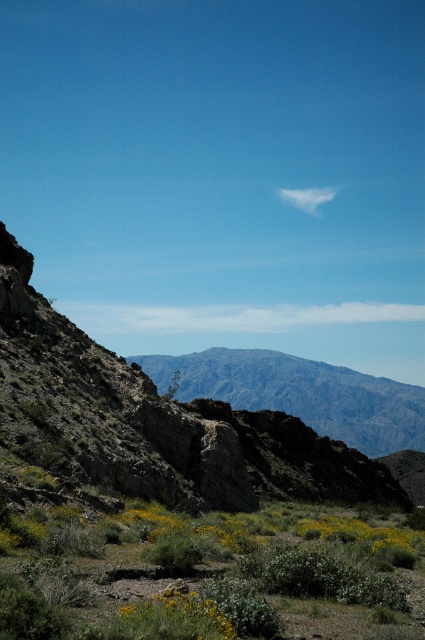
Question: Which object is farther from the camera taking this photo?

Choices:
 (A) gray rocky mountain at center
 (B) rocky at center

Answer: (A)

Question: Is rocky at center smaller than gray rocky mountain at center?

Choices:
 (A) yes
 (B) no

Answer: (A)

Question: Does rocky at center have a larger size compared to gray rocky mountain at center?

Choices:
 (A) no
 (B) yes

Answer: (A)

Question: Which object is closer to the camera taking this photo?

Choices:
 (A) rocky at center
 (B) gray rocky mountain at center

Answer: (A)

Question: Can you confirm if rocky at center is positioned above gray rocky mountain at center?

Choices:
 (A) no
 (B) yes

Answer: (B)